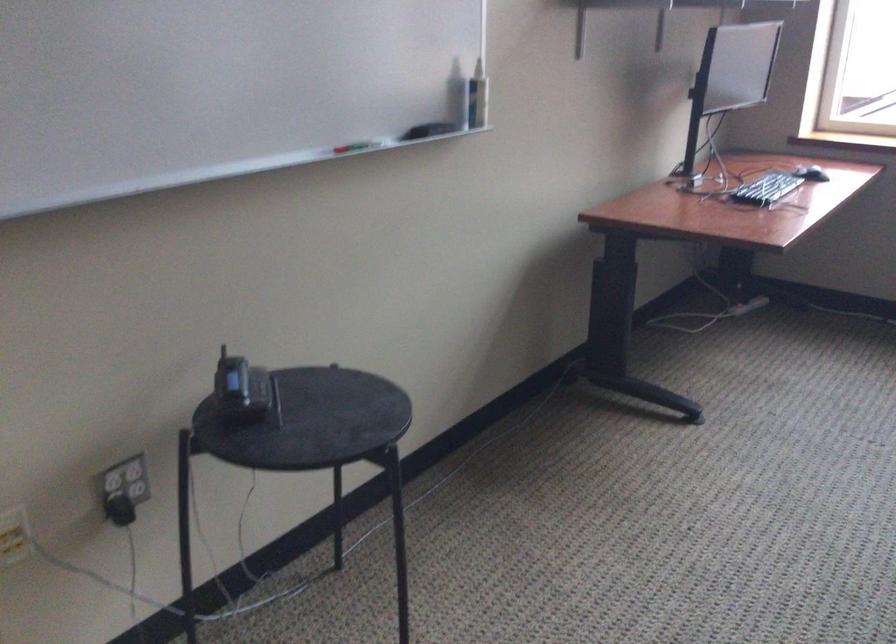
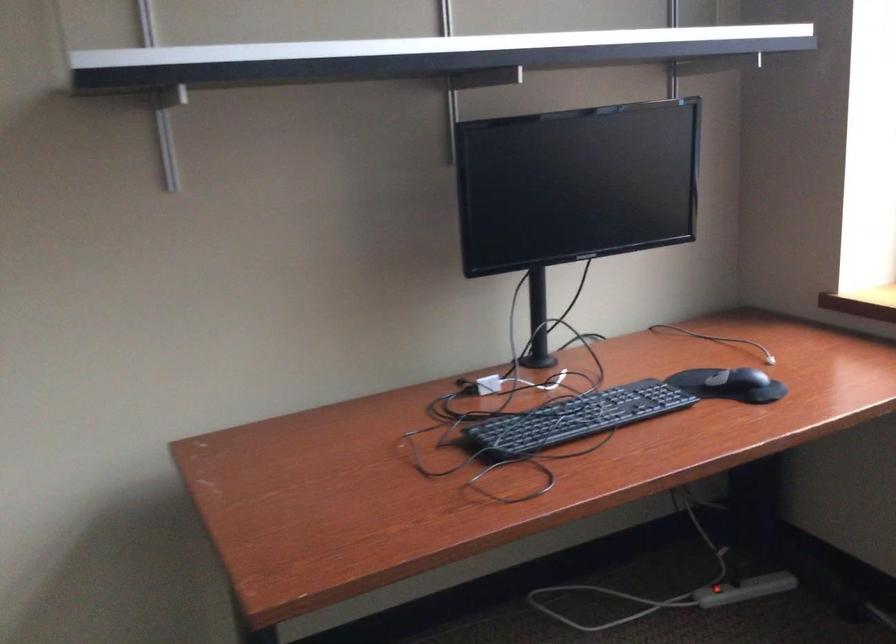
What movement of the cameraman would produce the second image?

The cameraman moved toward right, forward.